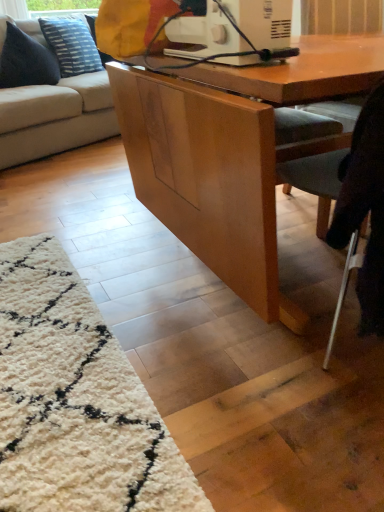
Question: Considering the positions of blue textured pillow at upper left, the first pillow from the back, and white plastic sewing machine at upper center in the image, is blue textured pillow at upper left, the first pillow from the back, taller or shorter than white plastic sewing machine at upper center?

Choices:
 (A) tall
 (B) short

Answer: (A)

Question: From the image's perspective, is blue textured pillow at upper left, the first pillow from the back, positioned above or below white plastic sewing machine at upper center?

Choices:
 (A) above
 (B) below

Answer: (A)

Question: Which is nearer to the white plastic sewing machine at upper center?

Choices:
 (A) dark blue fabric pillow at upper left, which ranks as the 1th pillow in front-to-back order
 (B) blue textured pillow at upper left, the first pillow from the back
 (C) beige fabric couch at left
 (D) light gray fabric chair at lower right

Answer: (D)

Question: Which object is positioned closest to the dark blue fabric pillow at upper left, which ranks as the 1th pillow in front-to-back order?

Choices:
 (A) white plastic sewing machine at upper center
 (B) light gray fabric chair at lower right
 (C) beige fabric couch at left
 (D) blue textured pillow at upper left, the first pillow from the back

Answer: (D)